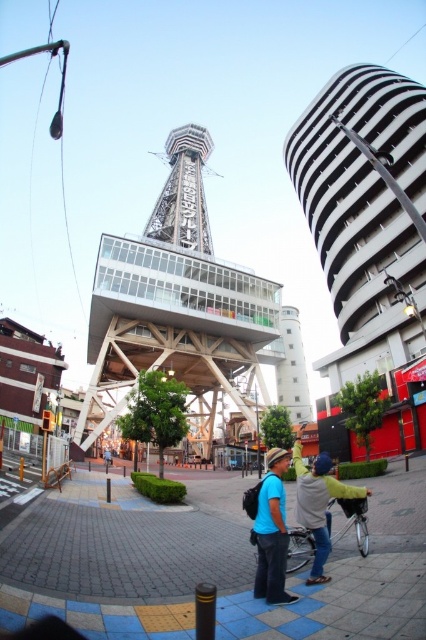
Question: Is metallic silver tower at center to the left of blue matte bicycle at center from the viewer's perspective?

Choices:
 (A) no
 (B) yes

Answer: (A)

Question: Is black striped tower at upper right thinner than blue fabric backpack at center?

Choices:
 (A) no
 (B) yes

Answer: (A)

Question: Which point appears closest to the camera in this image?

Choices:
 (A) (276, 534)
 (B) (203, 312)

Answer: (A)

Question: Which object is the closest to the glassy steel tower at center?

Choices:
 (A) metallic silver tower at center
 (B) blue fabric backpack at center
 (C) silver metallic bicycle at center
 (D) black striped tower at upper right

Answer: (A)

Question: Can you confirm if glassy steel tower at center is positioned to the right of blue matte bicycle at center?

Choices:
 (A) yes
 (B) no

Answer: (A)

Question: Estimate the real-world distances between objects in this image. Which object is closer to the black striped tower at upper right?

Choices:
 (A) metallic silver tower at center
 (B) blue fabric backpack at center
 (C) light gray hoodie at lower center

Answer: (A)